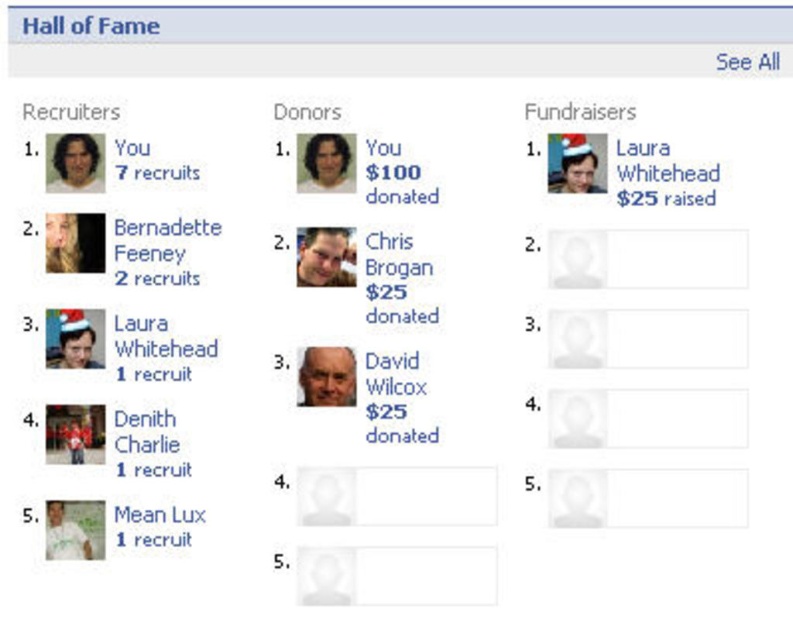
You are using a dating app and see two profile pictures side by side. One shows a smooth skin face at center and the other shows a matte black face at center. Which profile picture has a larger face in the image?

The smooth skin face at center is larger in size than the matte black face at center.

You are standing in front of the Hall of Fame section and notice two points marked on the screen. The first point is at coordinates point (86, 20) and the second is at point (60, 522). Which point appears closer to you?

The point at coordinates point (86, 20) is closer to you than the point at point (60, 522).

You are a user viewing the Hall of Fame section on this platform. You notice the matte plastic face at upper center and the matte black face at lower left. Which of these two faces is positioned higher up in the layout?

The matte plastic face at upper center is positioned higher up in the layout than the matte black face at lower left.